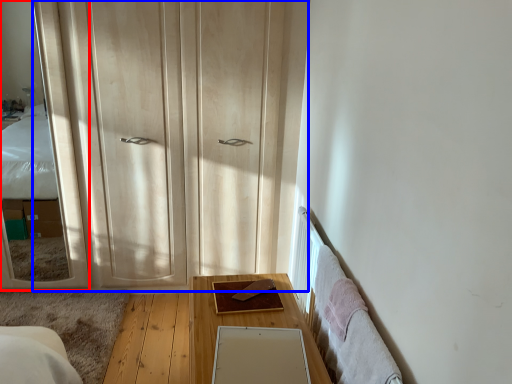
Question: Which object appears closest to the camera in this image, mirror (highlighted by a red box) or dresser (highlighted by a blue box)?

Choices:
 (A) mirror
 (B) dresser

Answer: (A)